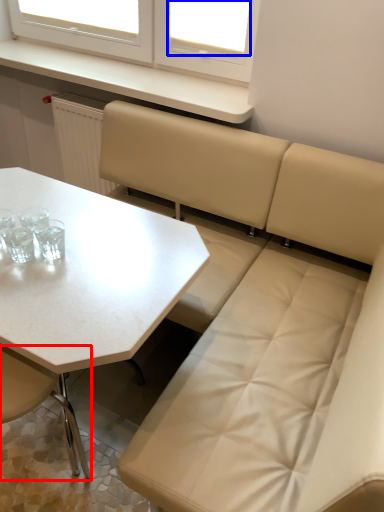
Question: Which point is further to the camera, chair (highlighted by a red box) or window screen (highlighted by a blue box)?

Choices:
 (A) chair
 (B) window screen

Answer: (B)